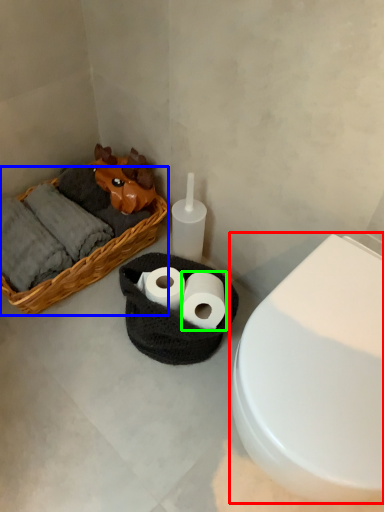
Question: Which is nearer to the toilet (highlighted by a red box)? basket (highlighted by a blue box) or toilet paper (highlighted by a green box).

Choices:
 (A) basket
 (B) toilet paper

Answer: (B)